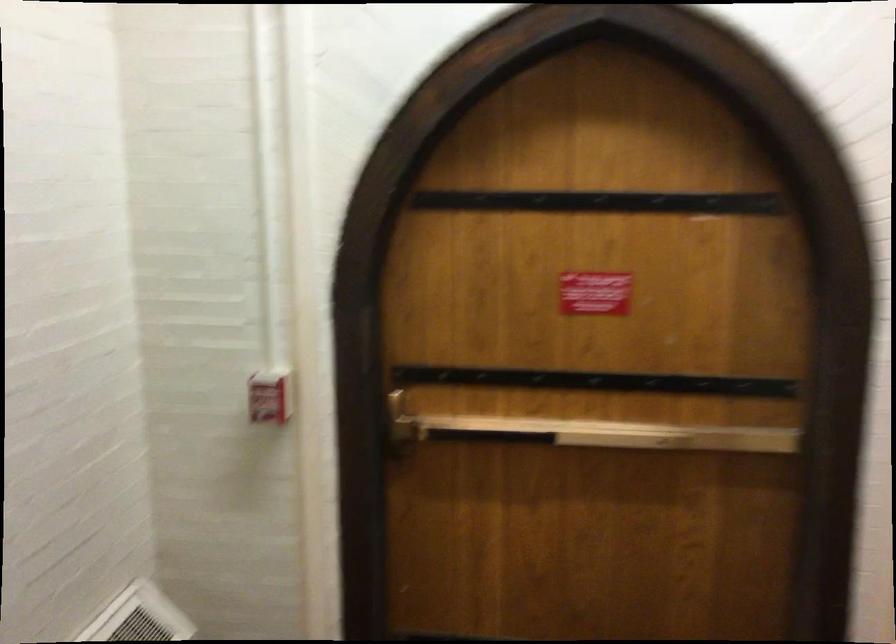
Where would you pull the red fire alarm? Please return your answer as a coordinate pair (x, y).

(270, 395)